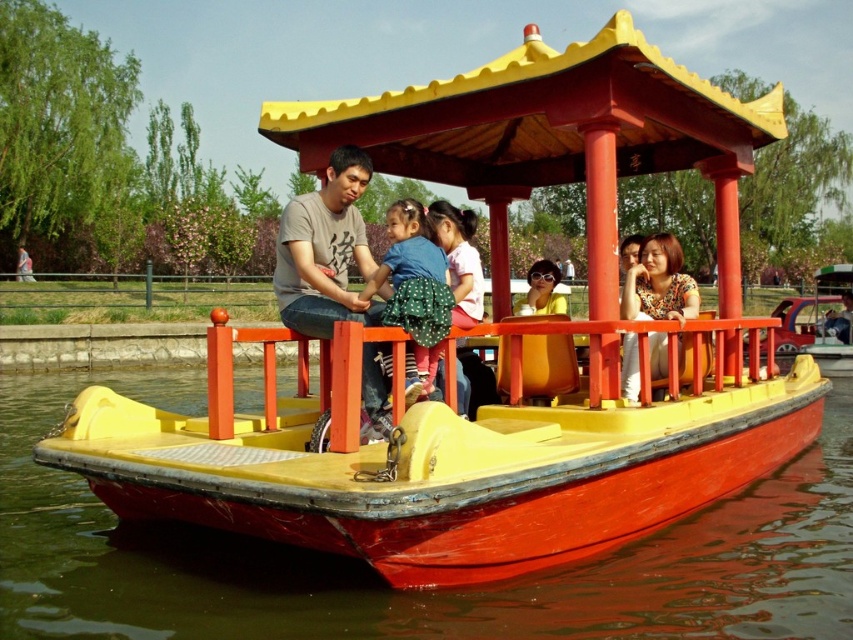
Is polka dot fabric dress at center in front of floral-patterned blouse at center?

Yes, polka dot fabric dress at center is in front of floral-patterned blouse at center.

Looking at this image, between polka dot fabric dress at center and floral-patterned blouse at center, which one appears on the right side from the viewer's perspective?

From the viewer's perspective, floral-patterned blouse at center appears more on the right side.

Locate an element on the screen. Image resolution: width=853 pixels, height=640 pixels. polka dot fabric dress at center is located at coordinates (415, 285).

Locate an element on the screen. This screenshot has height=640, width=853. polka dot fabric dress at center is located at coordinates (415, 285).

Between red matte water at lower center and polka dot fabric dress at center, which one appears on the left side from the viewer's perspective?

polka dot fabric dress at center is more to the left.

Which is behind, point (631, 596) or point (434, 276)?

Point (434, 276)

Where is `red matte water at lower center`? red matte water at lower center is located at coordinates (408, 589).

Does red matte water at lower center appear on the left side of floral-patterned blouse at center?

Indeed, red matte water at lower center is positioned on the left side of floral-patterned blouse at center.

Which is more to the left, red matte water at lower center or floral-patterned blouse at center?

Positioned to the left is red matte water at lower center.

Between point (816, 604) and point (662, 276), which one is positioned in front?

Point (816, 604) is more forward.

Locate an element on the screen. red matte water at lower center is located at coordinates (408, 589).